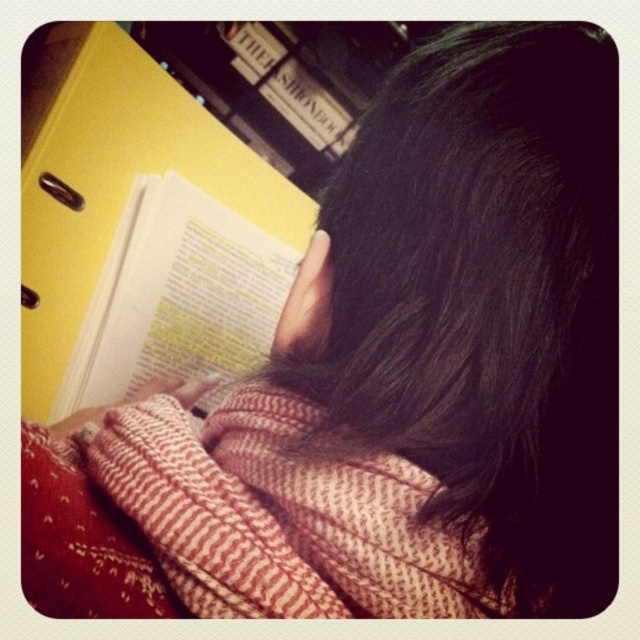
You are a photographer trying to capture a closeup of the white paper book at upper left without the dark brown hair at upper center blocking it. Since you can only move the camera left or right, which direction should you move to ensure the book is fully visible?

The dark brown hair at upper center has a lesser width compared to the white paper book at upper left, so moving the camera to the right would position the narrower hair away from the book, allowing the book to be fully visible without obstruction.

You are a photographer trying to capture a closeup of the white paper book at upper left without the dark brown hair at upper center blocking the view. Based on their sizes, can you tell which one you should focus on first to ensure the book is fully visible?

The dark brown hair at upper center is larger in size than the white paper book at upper left. To ensure the book is fully visible, focus on the white paper book at upper left first since it is smaller and less likely to block the view.